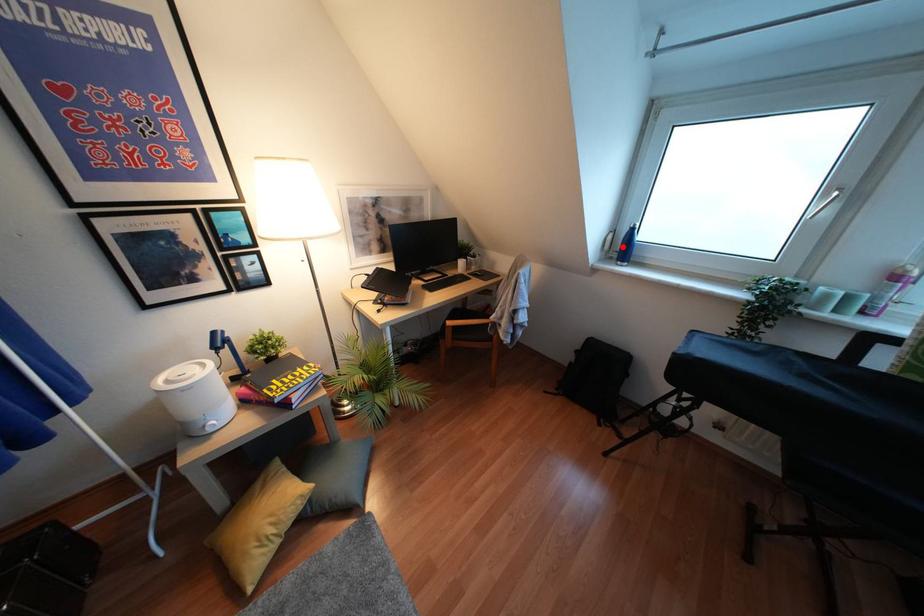
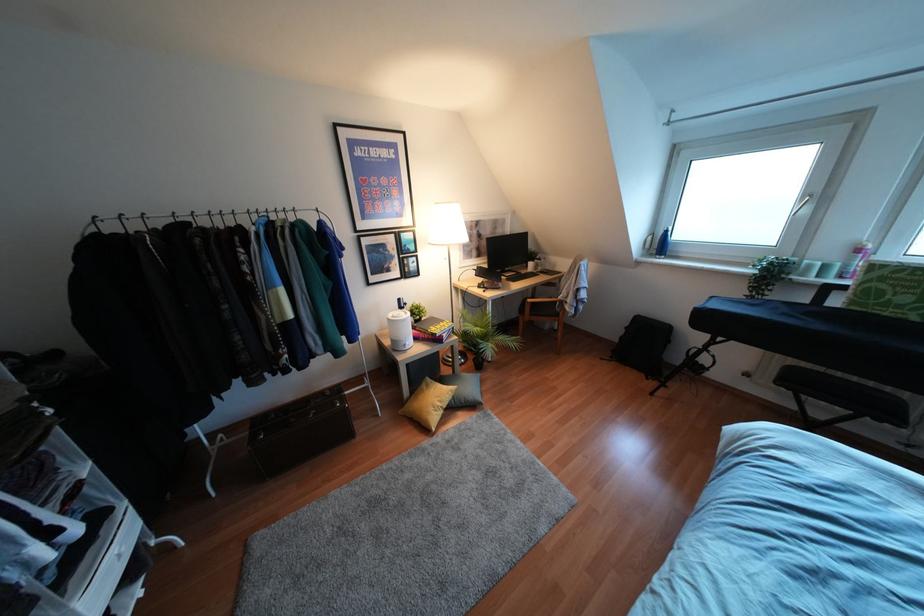
Question: I am providing you with two images of the same scene from different viewpoints. A red point is marked on the first image. At the location where the point appears in image 1, is it still visible in image 2?

Choices:
 (A) Yes
 (B) No

Answer: (A)